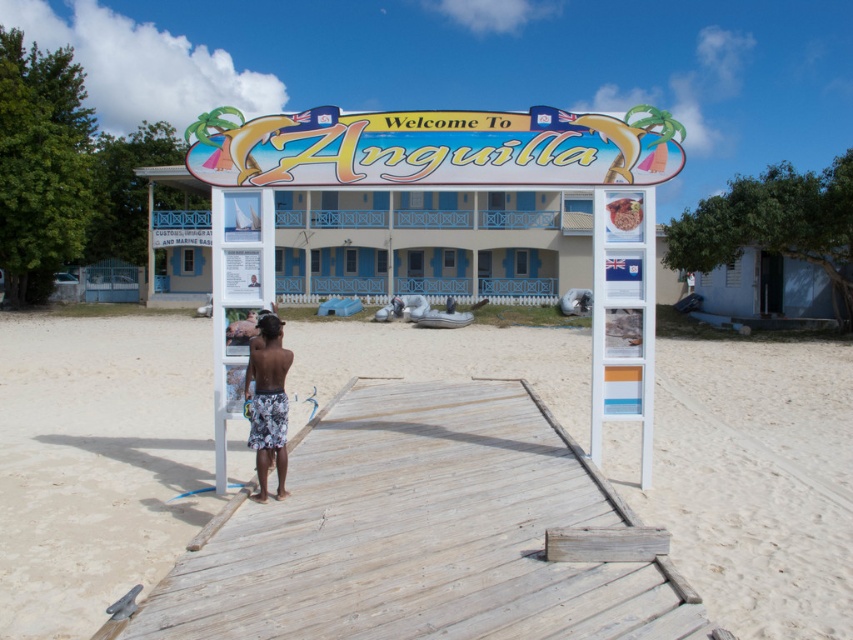
You are standing on the wooden walkway and want to place a small bench between the two points labeled point (372,465) and point (273,436). Which point should the bench be closer to in order to be closer to the viewer?

The bench should be closer to point (372,465) because it is closer to the viewer than point (273,436).

You are a visitor at the Anguilla beach and want to step onto the weathered wood dock at center from the white floral shorts at center. Can you do so comfortably without needing to climb?

The weathered wood dock at center is not as tall as the white floral shorts at center, so stepping onto it would be comfortable without needing to climb.